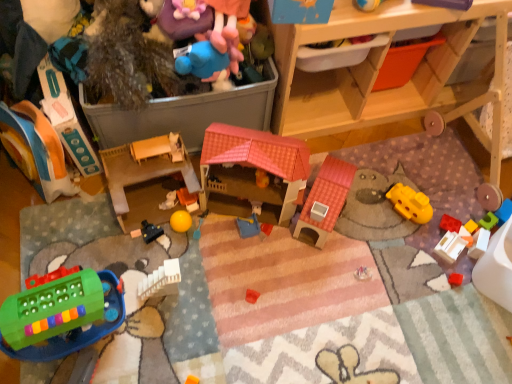
Where is `free location in front of smooth plastic toy at center, arranged as the 5th toy when viewed from the left`? free location in front of smooth plastic toy at center, arranged as the 5th toy when viewed from the left is located at coordinates (146, 251).